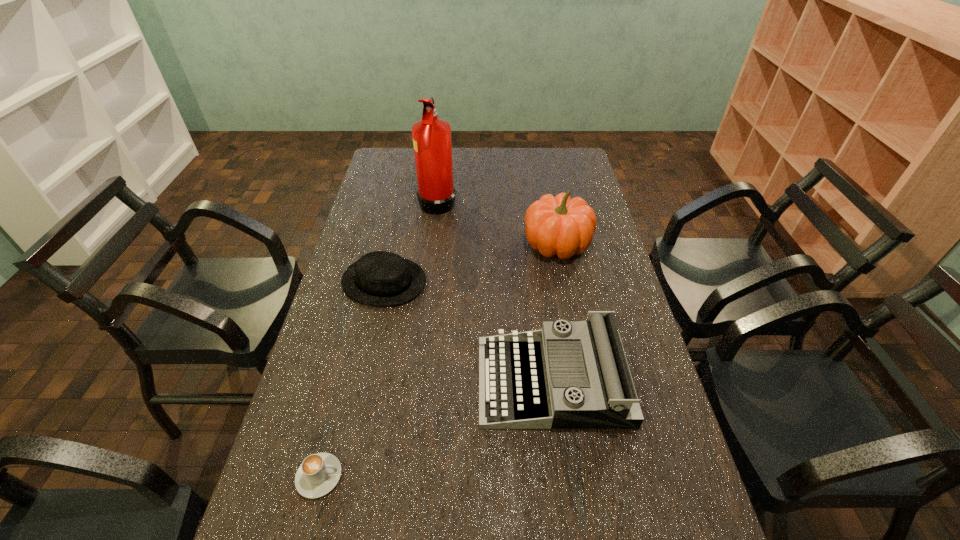
Identify the location of vacant area that lies between the third shortest object and the fedora. The height and width of the screenshot is (540, 960). (468, 332).

Where is `free space between the fedora and the farthest object`? free space between the fedora and the farthest object is located at coordinates (411, 241).

Identify the location of free space between the nearest object and the pumpkin. (439, 360).

At what (x,y) coordinates should I click in order to perform the action: click on vacant area between the shortest object and the fourth tallest object. Please return your answer as a coordinate pair (x, y). Looking at the image, I should click on (351, 379).

Select which object appears as the fourth closest to the second shortest object. Please provide its 2D coordinates. Your answer should be formatted as a tuple, i.e. [(x, y)], where the tuple contains the x and y coordinates of a point satisfying the conditions above.

[(318, 474)]

Find the location of a particular element. object that is the closest one to the cappuccino is located at coordinates (569, 375).

At what (x,y) coordinates should I click in order to perform the action: click on free spot that satisfies the following two spatial constraints: 1. at the spray nozzle of the fourth shortest object; 2. on the right side of the tallest object. Please return your answer as a coordinate pair (x, y). Looking at the image, I should click on (432, 245).

The image size is (960, 540). In order to click on vacant point that satisfies the following two spatial constraints: 1. at the spray nozzle of the second tallest object; 2. on the right side of the fire extinguisher in this screenshot , I will do `click(432, 245)`.

Where is `vacant space that satisfies the following two spatial constraints: 1. at the spray nozzle of the fire extinguisher; 2. on the front side of the second shortest object`? The height and width of the screenshot is (540, 960). vacant space that satisfies the following two spatial constraints: 1. at the spray nozzle of the fire extinguisher; 2. on the front side of the second shortest object is located at coordinates (428, 281).